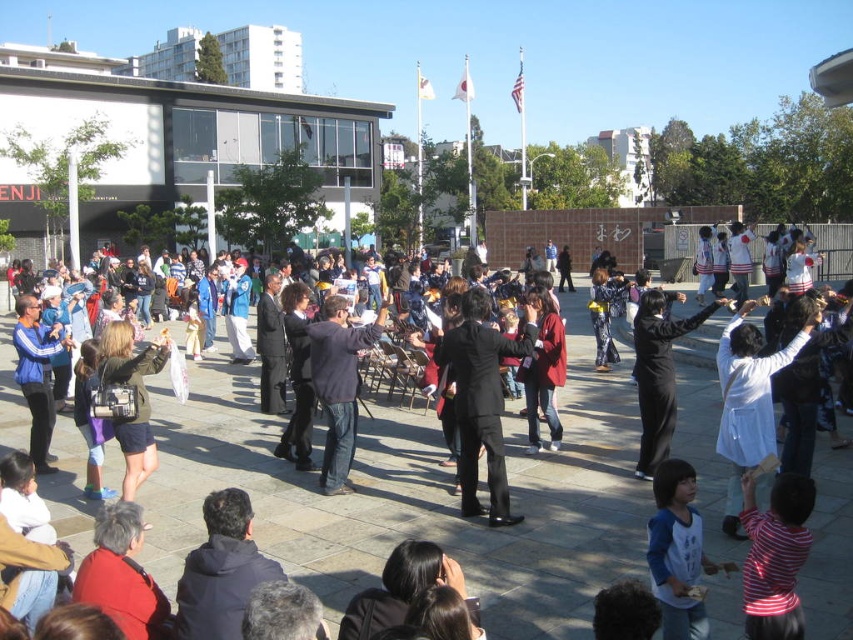
Is striped cotton shirt at lower right further to camera compared to black matte pants at center?

No, it is in front of black matte pants at center.

The image size is (853, 640). I want to click on striped cotton shirt at lower right, so click(775, 556).

Describe the element at coordinates (775, 556) in the screenshot. I see `striped cotton shirt at lower right` at that location.

Where is `striped cotton shirt at lower right`? striped cotton shirt at lower right is located at coordinates click(x=775, y=556).

Between white matte coat at center and blue jersey at center, which one is positioned higher?

white matte coat at center is above.

Consider the image. Does white matte coat at center appear on the right side of blue jersey at center?

Correct, you'll find white matte coat at center to the right of blue jersey at center.

This screenshot has height=640, width=853. Find the location of `white matte coat at center`. white matte coat at center is located at coordinates (751, 397).

Between black smooth suit at center and blue jersey at center, which one has less height?

blue jersey at center is shorter.

Consider the image. Does black smooth suit at center have a greater height compared to blue jersey at center?

Yes.

This screenshot has width=853, height=640. What do you see at coordinates (480, 400) in the screenshot?
I see `black smooth suit at center` at bounding box center [480, 400].

This screenshot has width=853, height=640. What are the coordinates of `black smooth suit at center` in the screenshot? It's located at (480, 400).